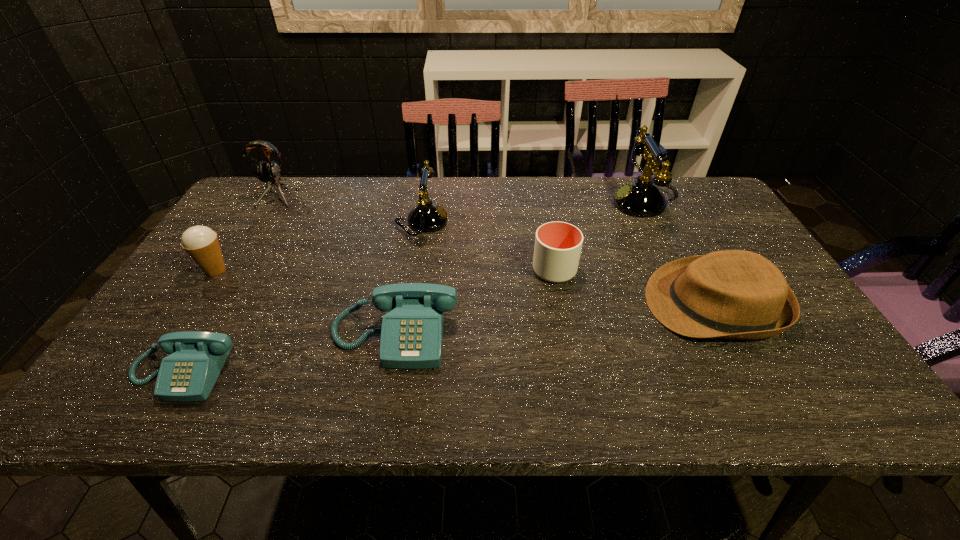
Where is `object at the far left corner`? This screenshot has height=540, width=960. object at the far left corner is located at coordinates (266, 172).

Where is `object that is at the near left corner`? Image resolution: width=960 pixels, height=540 pixels. object that is at the near left corner is located at coordinates [189, 373].

The height and width of the screenshot is (540, 960). Find the location of `object present at the far right corner`. object present at the far right corner is located at coordinates (641, 198).

In the image, there is a desktop. Identify the location of free space at the far edge. This screenshot has width=960, height=540. (574, 194).

The height and width of the screenshot is (540, 960). Find the location of `free space at the near edge of the desktop`. free space at the near edge of the desktop is located at coordinates (717, 377).

Identify the location of vacant space at the left edge of the desktop. The image size is (960, 540). (273, 227).

This screenshot has width=960, height=540. Identify the location of vacant space at the far right corner. (669, 185).

This screenshot has height=540, width=960. Identify the location of vacant space that is in between the second shortest telephone and the brown fedora. (554, 320).

Where is `vacant space that's between the right blue telephone and the bigger black telephone`? The height and width of the screenshot is (540, 960). vacant space that's between the right blue telephone and the bigger black telephone is located at coordinates (519, 268).

You are a GUI agent. You are given a task and a screenshot of the screen. Output one action in this format:
    pyautogui.click(x=<x>, y=<y>)
    Task: Click on the free space between the shortest telephone and the earphone
    This screenshot has width=960, height=540.
    Given the screenshot: What is the action you would take?
    pyautogui.click(x=228, y=284)